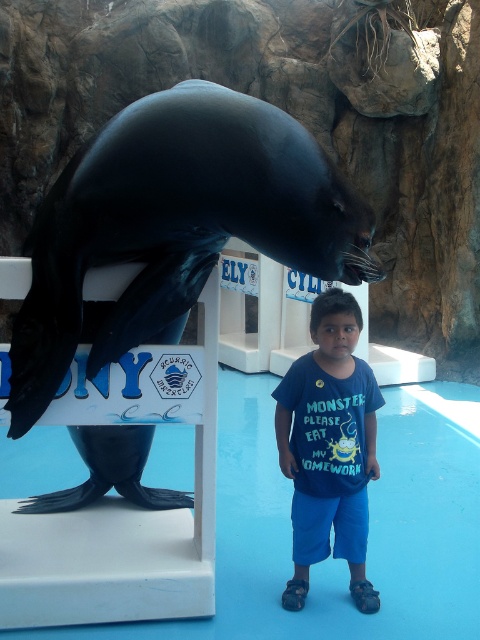
Is shiny black seal at center taller than blue cotton shirt at center?

Yes.

Consider the image. Between shiny black seal at center and blue cotton shirt at center, which one is positioned lower?

blue cotton shirt at center is lower down.

Is point (323, 152) positioned after point (367, 582)?

No, (323, 152) is closer to viewer.

Find the location of a particular element. This screenshot has width=480, height=640. shiny black seal at center is located at coordinates click(175, 225).